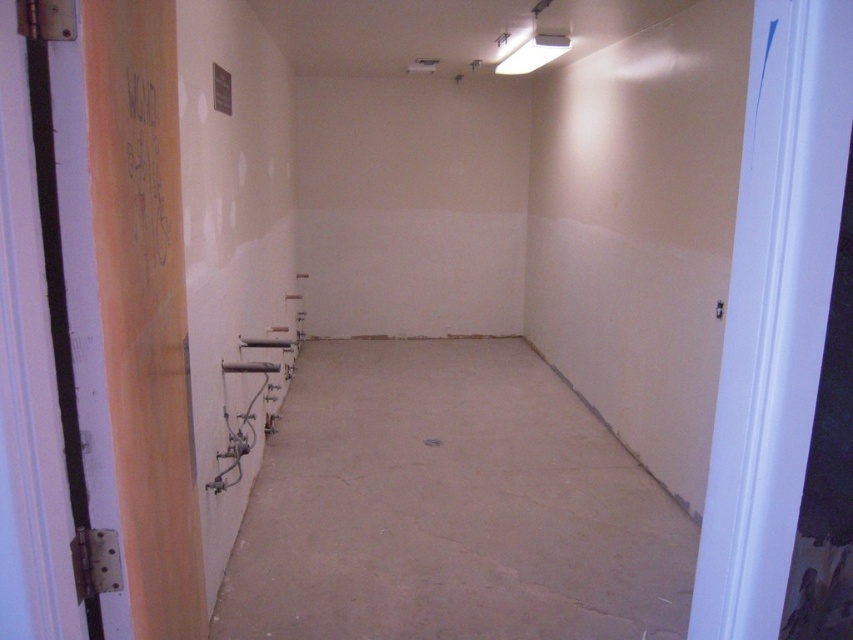
You are a contractor assessing the room. You need to place a 1.2m tall storage unit in the room. Given the smooth concrete floor at center and the orange matte door at left, which object would be suitable for placing the storage unit?

The smooth concrete floor at center is suitable for placing the 1.2m tall storage unit because it is not as tall as the orange matte door at left, meaning the floor is lower and provides a stable base for the unit.